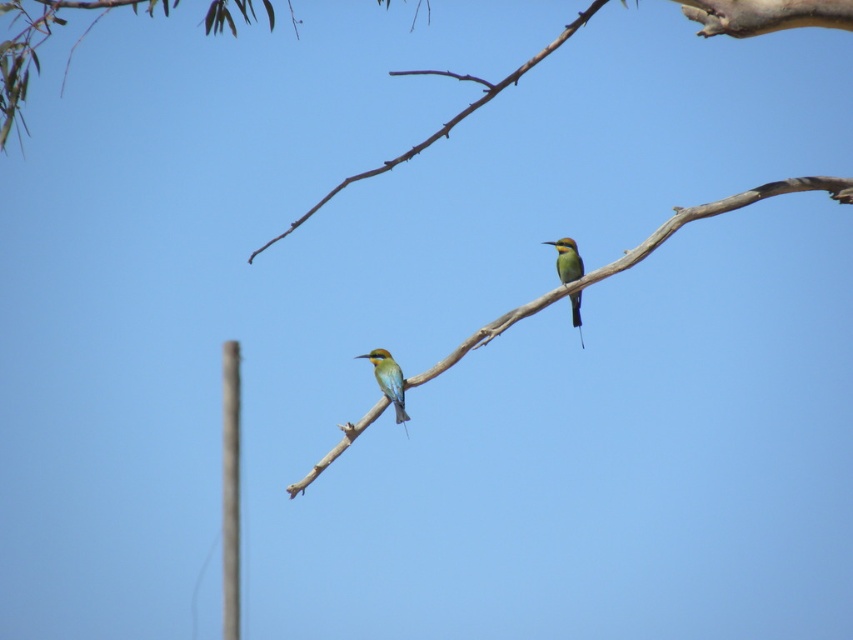
Between smooth wood branch at center and green glossy bee-eater at center, which one is positioned lower?

green glossy bee-eater at center is below.

Who is more distant from viewer, (349, 440) or (379, 372)?

The point (379, 372) is behind.

Measure the distance between point (416, 376) and camera.

Point (416, 376) is 7.50 meters away from camera.

Identify the location of smooth wood branch at center. Image resolution: width=853 pixels, height=640 pixels. [x=637, y=257].

Who is higher up, gray concrete pole at left or green glossy bee-eater at center?

Positioned higher is green glossy bee-eater at center.

Who is more forward, (236, 548) or (401, 404)?

Positioned in front is point (401, 404).

Locate an element on the screen. Image resolution: width=853 pixels, height=640 pixels. gray concrete pole at left is located at coordinates (230, 490).

Does smooth wood branch at center appear over green iridescent parrot at center?

No, smooth wood branch at center is not above green iridescent parrot at center.

Which is more to the left, smooth wood branch at center or green iridescent parrot at center?

smooth wood branch at center is more to the left.

This screenshot has width=853, height=640. What do you see at coordinates (637, 257) in the screenshot?
I see `smooth wood branch at center` at bounding box center [637, 257].

This screenshot has height=640, width=853. In order to click on smooth wood branch at center in this screenshot , I will do (637, 257).